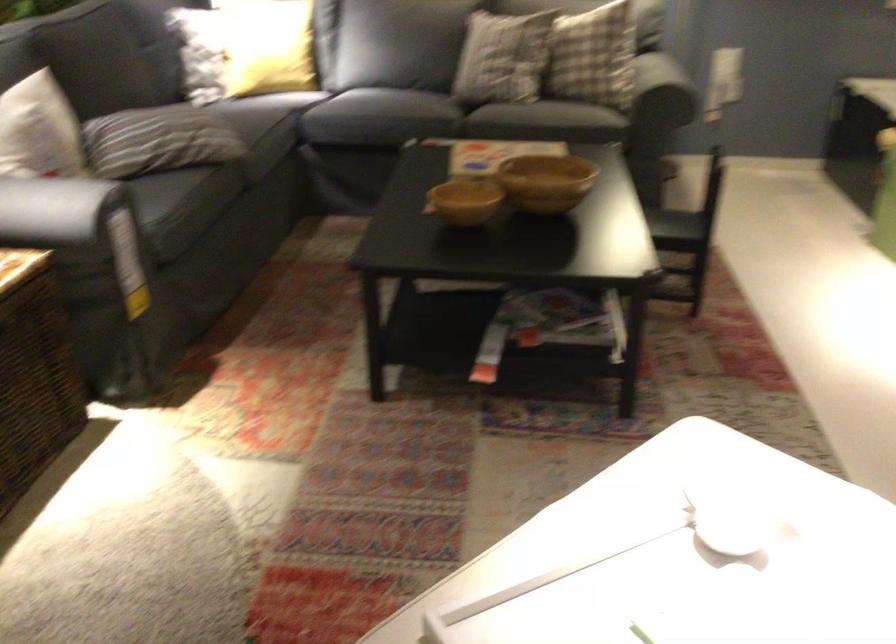
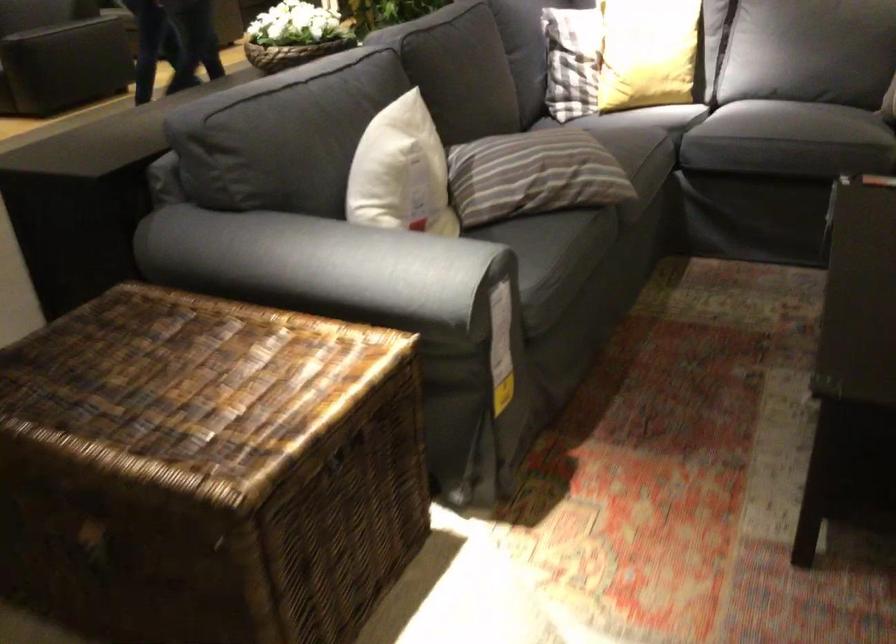
In the second image, find the point that corresponds to point (364, 105) in the first image.

(768, 122)